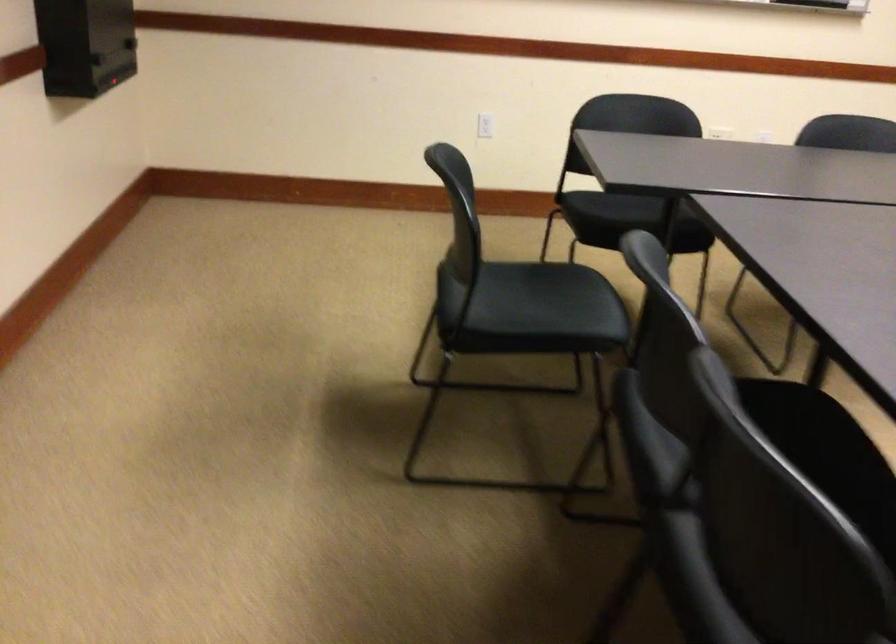
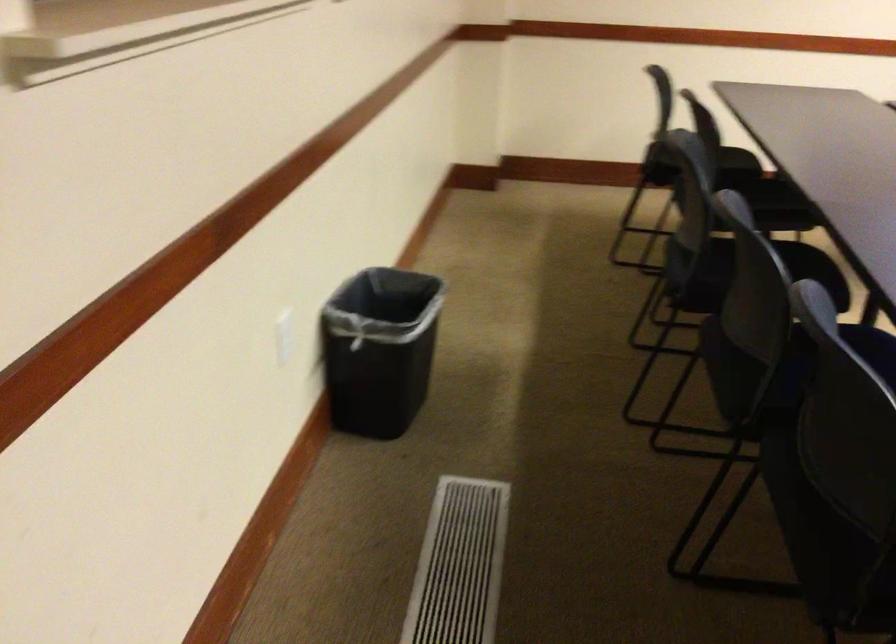
How did the camera likely rotate?

The camera rotated toward right-down.